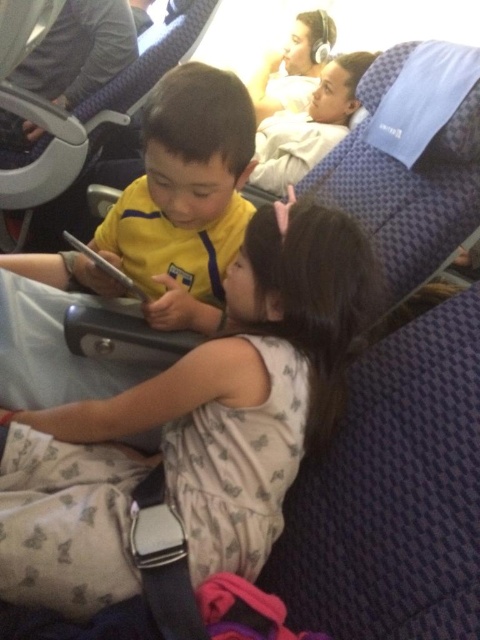
You are a flight attendant checking seat spacing. The airline requires at least 20 centimeters between passengers for comfort. Are the light beige fabric dress at center and yellow matte shirt at center meeting this requirement?

The distance between the light beige fabric dress at center and yellow matte shirt at center is 21.50 centimeters, which exceeds the minimum requirement of 20 centimeters. Therefore, they are meeting the airline comfort requirement.

You are a passenger sitting in the airplane cabin and want to take a photo of both the point at coordinates point (275,416) and point (260,65). Which point should you focus on first to ensure both are in focus?

You should focus on point (260,65) first because it is farther from the camera than point (275,416), and adjusting focus from far to near increases the chance of both being in focus.

You are a flight attendant on an airplane. You need to determine which of the two items at center is bigger. The items are the light beige fabric dress at center and the yellow matte shirt at center. Can you identify the larger one?

The light beige fabric dress at center is larger than the yellow matte shirt at center according to the description provided.